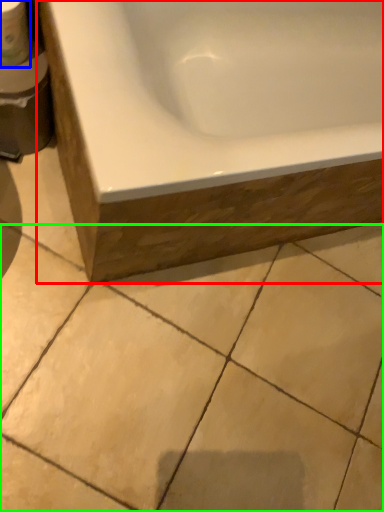
Question: Which object is positioned closest to bathtub (highlighted by a red box)? Select from toilet paper (highlighted by a blue box) and ceramic tile (highlighted by a green box).

Choices:
 (A) toilet paper
 (B) ceramic tile

Answer: (B)